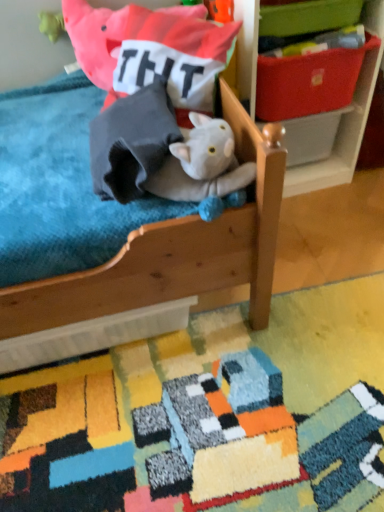
The width and height of the screenshot is (384, 512). I want to click on empty space that is ontop of multicolored textured rug at lower center, so click(x=225, y=405).